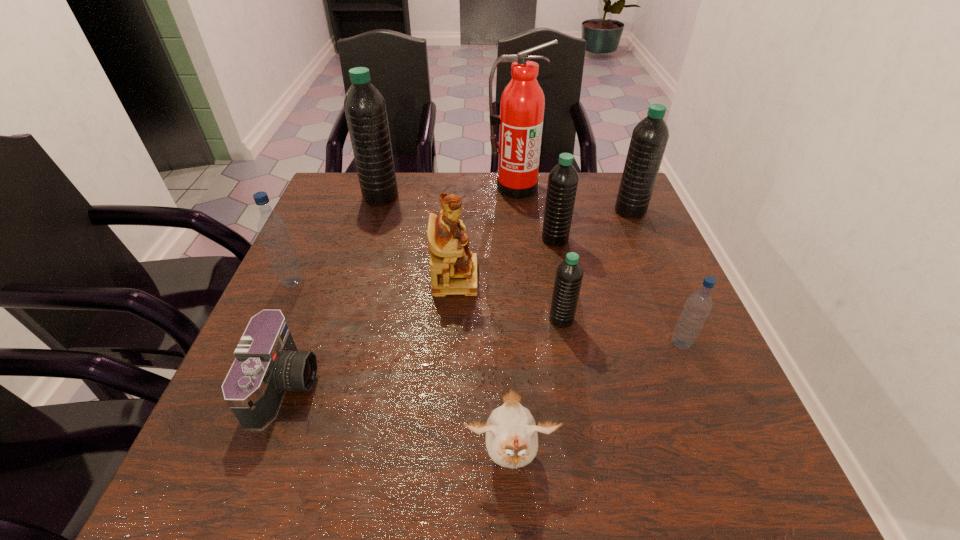
The image size is (960, 540). Identify the location of fire extinguisher. (522, 105).

Locate an element on the screen. This screenshot has width=960, height=540. the biggest black water bottle is located at coordinates (365, 108).

The width and height of the screenshot is (960, 540). What are the coordinates of `the leftmost black water bottle` in the screenshot? It's located at (365, 108).

You are a GUI agent. You are given a task and a screenshot of the screen. Output one action in this format:
    pyautogui.click(x=<x>, y=<y>)
    Task: Click on the rightmost black water bottle
    The height and width of the screenshot is (540, 960).
    Given the screenshot: What is the action you would take?
    pyautogui.click(x=649, y=139)

The width and height of the screenshot is (960, 540). I want to click on the second tallest water bottle, so click(649, 139).

The height and width of the screenshot is (540, 960). Identify the location of the third farthest black water bottle. (563, 179).

You are a GUI agent. You are given a task and a screenshot of the screen. Output one action in this format:
    pyautogui.click(x=<x>, y=<y>)
    Task: Click on the third biggest black water bottle
    
    Given the screenshot: What is the action you would take?
    pyautogui.click(x=563, y=179)

Identify the location of the third nearest water bottle. This screenshot has height=540, width=960. (272, 229).

Locate an element on the screen. the farther blue water bottle is located at coordinates (272, 229).

Locate an element on the screen. This screenshot has width=960, height=540. figurine is located at coordinates (453, 267).